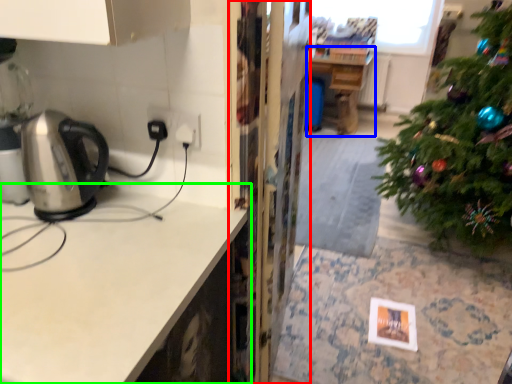
Question: Based on their relative distances, which object is nearer to screen door (highlighted by a red box)? Choose from table (highlighted by a blue box) and countertop (highlighted by a green box).

Choices:
 (A) table
 (B) countertop

Answer: (B)